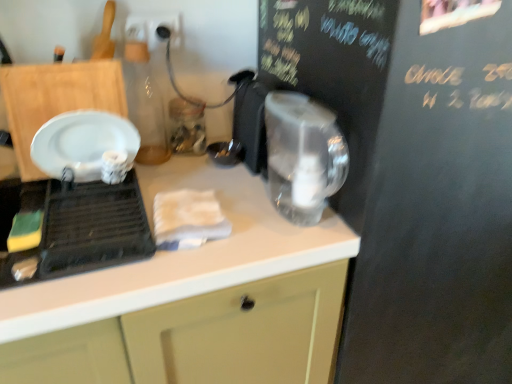
This screenshot has width=512, height=384. Identify the location of free spot to the right of white glossy plate at left. (226, 217).